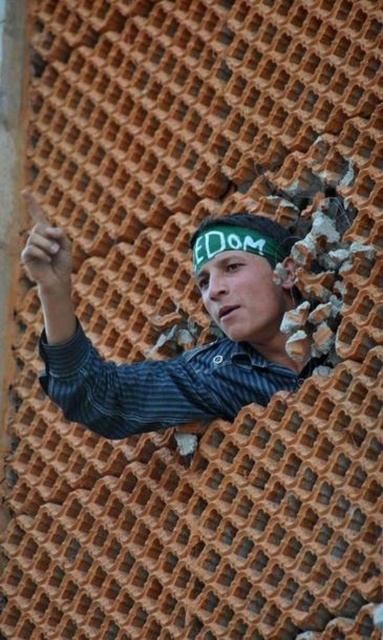
Based on the scene description, where is the striped shirt at upper left located in terms of its 2D coordinates?

The striped shirt at upper left is located at the 2D coordinates of point (176, 356).

You are an assistant helping someone choose outfits for a casual day. The person wants to wear both the striped cotton shirt at center and the green fabric headscarf at center. Can you suggest which item should be worn first to ensure proper visibility of both?

The striped cotton shirt at center is bigger than the green fabric headscarf at center. To ensure both are visible, wear the green fabric headscarf at center first, then the shirt so it doesn

You are a fashion designer observing the image. You need to determine the layering order of the striped cotton shirt at center and the green fabric headscarf at center. Which one is visible on top?

The striped cotton shirt at center is positioned under green fabric headscarf at center, so the green fabric headscarf at center is visible on top.